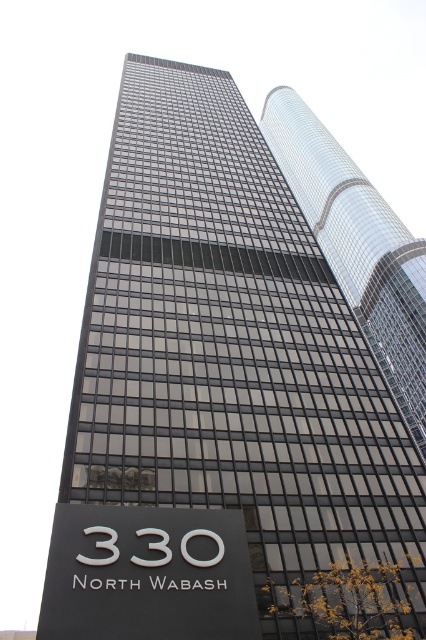
Is point (187, 532) in front of point (186, 532)?

No, (187, 532) is behind (186, 532).

How distant is black matte sign at lower center from white glossy sign at center?

A distance of 4.67 meters exists between black matte sign at lower center and white glossy sign at center.

Locate an element on the screen. This screenshot has height=640, width=426. black matte sign at lower center is located at coordinates (147, 573).

Is the position of glossy glass skyscraper at upper center less distant than that of white glossy sign at center?

No, it is behind white glossy sign at center.

Is glossy glass skyscraper at upper center positioned at the back of white glossy sign at center?

Yes, it is behind white glossy sign at center.

Is point (405, 374) less distant than point (97, 541)?

No, it is not.

Image resolution: width=426 pixels, height=640 pixels. What are the coordinates of `glossy glass skyscraper at upper center` in the screenshot? It's located at (357, 246).

Who is positioned more to the left, black matte sign at lower center or glossy glass skyscraper at upper center?

black matte sign at lower center is more to the left.

How far apart are black matte sign at lower center and glossy glass skyscraper at upper center?

black matte sign at lower center and glossy glass skyscraper at upper center are 258.01 feet apart from each other.

Is point (149, 595) less distant than point (411, 240)?

Yes, point (149, 595) is in front of point (411, 240).

Locate an element on the screen. Image resolution: width=426 pixels, height=640 pixels. black matte sign at lower center is located at coordinates (147, 573).